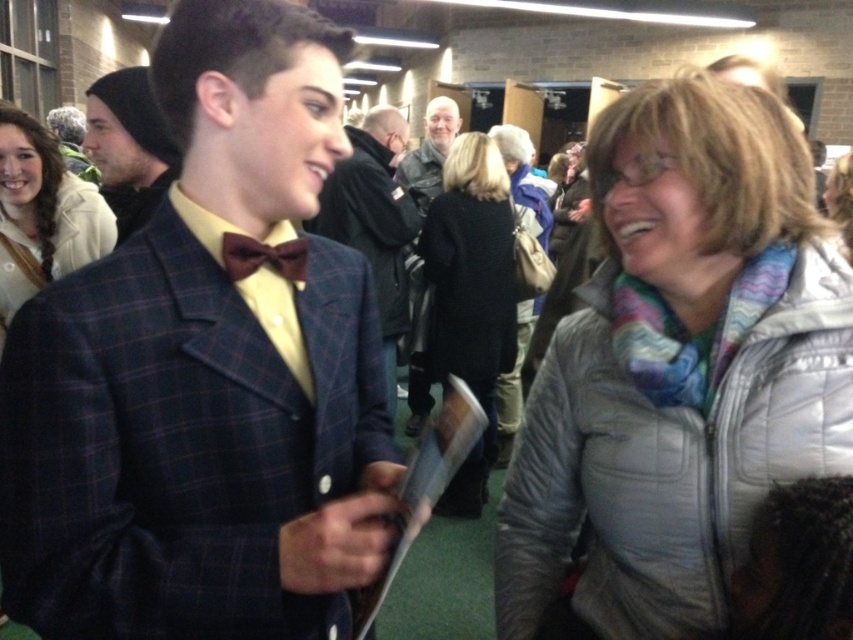
Between black wool coat at center and dark gray leather jacket at center, which one has less height?

Standing shorter between the two is dark gray leather jacket at center.

Does black wool coat at center have a lesser height compared to dark gray leather jacket at center?

No.

Between point (500, 164) and point (415, 157), which one is positioned in front?

Point (500, 164) is in front.

Locate an element on the screen. The height and width of the screenshot is (640, 853). black wool coat at center is located at coordinates click(469, 296).

Is black wool coat at center to the right of plaid wool jacket at center from the viewer's perspective?

Incorrect, black wool coat at center is not on the right side of plaid wool jacket at center.

Which is in front, point (474, 474) or point (527, 134)?

Point (474, 474) is in front.

Who is more forward, (508, 349) or (543, 224)?

Point (508, 349) is in front.

You are a GUI agent. You are given a task and a screenshot of the screen. Output one action in this format:
    pyautogui.click(x=<x>, y=<y>)
    Task: Click on the black wool coat at center
    The image size is (853, 640).
    Given the screenshot: What is the action you would take?
    pyautogui.click(x=469, y=296)

Who is taller, plaid wool blazer at center or black wool coat at center?

black wool coat at center

This screenshot has width=853, height=640. I want to click on plaid wool blazer at center, so click(206, 374).